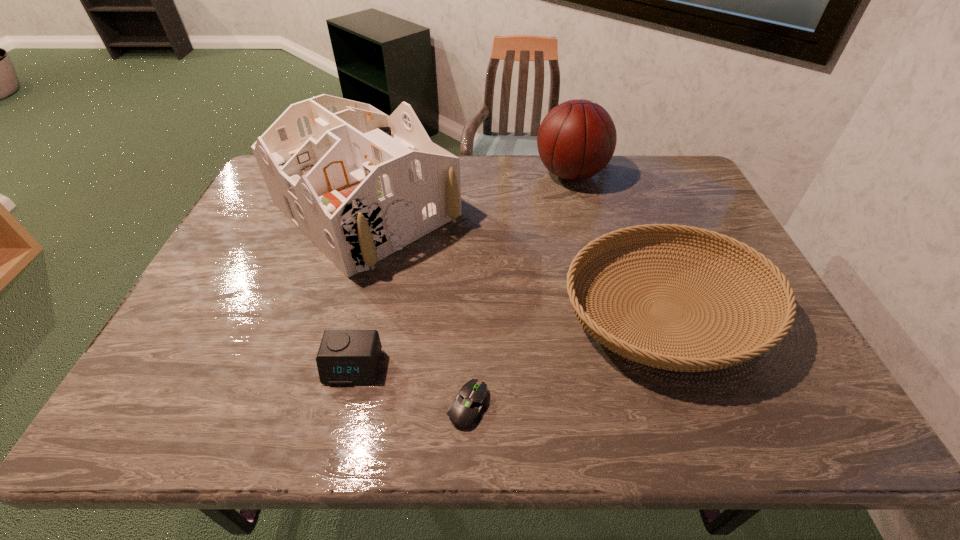
You are a GUI agent. You are given a task and a screenshot of the screen. Output one action in this format:
    pyautogui.click(x=<x>, y=<y>)
    Task: Click on the unoccupied position between the second shortest object and the dollhouse
    The height and width of the screenshot is (540, 960).
    Given the screenshot: What is the action you would take?
    pyautogui.click(x=359, y=288)

Find the location of a particular element. Image resolution: width=960 pixels, height=540 pixels. free area in between the basket and the alarm clock is located at coordinates (510, 339).

Where is `blank region between the basketball and the shortest object`? blank region between the basketball and the shortest object is located at coordinates (518, 289).

This screenshot has height=540, width=960. Find the location of `unoccupied position between the shortest object and the basketball`. unoccupied position between the shortest object and the basketball is located at coordinates (518, 289).

Locate an element on the screen. This screenshot has height=540, width=960. blank region between the basketball and the shortest object is located at coordinates (518, 289).

Identify the location of vacant space in between the computer mouse and the dollhouse. (417, 307).

You are a GUI agent. You are given a task and a screenshot of the screen. Output one action in this format:
    pyautogui.click(x=<x>, y=<y>)
    Task: Click on the unoccupied area between the basketball and the computer mouse
    This screenshot has height=540, width=960.
    Given the screenshot: What is the action you would take?
    pyautogui.click(x=518, y=289)

Locate an element on the screen. free space between the shortest object and the basketball is located at coordinates (518, 289).

This screenshot has height=540, width=960. What are the coordinates of `free space between the third tallest object and the fourth tallest object` in the screenshot? It's located at (510, 339).

At what (x,y) coordinates should I click in order to perform the action: click on the fourth closest object relative to the second shortest object. Please return your answer as a coordinate pair (x, y). The image size is (960, 540). Looking at the image, I should click on (577, 138).